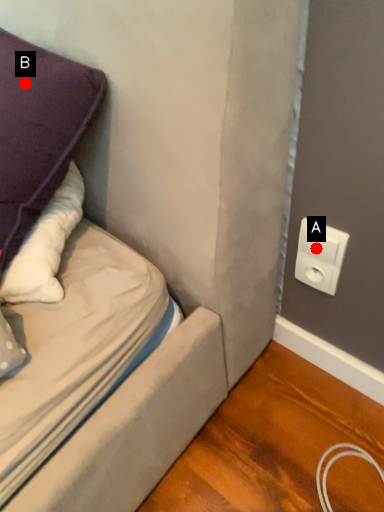
Question: Two points are circled on the image, labeled by A and B beside each circle. Which point appears closest to the camera in this image?

Choices:
 (A) A is closer
 (B) B is closer

Answer: (B)